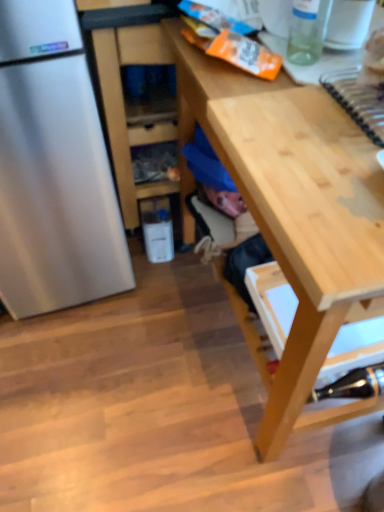
Question: From the image's perspective, is light wood desk at center under transparent glass bottle at upper right, placed as the 2th bottle when sorted from back to front?

Choices:
 (A) yes
 (B) no

Answer: (A)

Question: Does light wood desk at center have a greater width compared to transparent glass bottle at upper right, the 2th bottle positioned from the bottom?

Choices:
 (A) yes
 (B) no

Answer: (A)

Question: Is transparent glass bottle at upper right, which is the 1th bottle in left-to-right order, at the back of light wood desk at center?

Choices:
 (A) no
 (B) yes

Answer: (A)

Question: Considering the relative positions of light wood desk at center and transparent glass bottle at upper right, placed as the 2th bottle when sorted from back to front, in the image provided, is light wood desk at center behind transparent glass bottle at upper right, placed as the 2th bottle when sorted from back to front,?

Choices:
 (A) no
 (B) yes

Answer: (A)

Question: Is light wood desk at center directly adjacent to transparent glass bottle at upper right, the 2th bottle positioned from the bottom?

Choices:
 (A) no
 (B) yes

Answer: (A)

Question: Relative to light wood desk at center, is transparent glass bottle at upper right, which ranks as the first bottle in top-to-bottom order, in front or behind?

Choices:
 (A) behind
 (B) front

Answer: (A)

Question: Considering the positions of transparent glass bottle at upper right, the 2th bottle positioned from the bottom, and light wood desk at center in the image, is transparent glass bottle at upper right, the 2th bottle positioned from the bottom, wider or thinner than light wood desk at center?

Choices:
 (A) thin
 (B) wide

Answer: (A)

Question: Is transparent glass bottle at upper right, which is the 1th bottle in left-to-right order, to the left or to the right of light wood desk at center in the image?

Choices:
 (A) left
 (B) right

Answer: (A)

Question: Based on their sizes in the image, would you say transparent glass bottle at upper right, placed as the 2th bottle when sorted from back to front, is bigger or smaller than light wood desk at center?

Choices:
 (A) big
 (B) small

Answer: (B)

Question: Does point (291, 49) appear closer or farther from the camera than point (360, 392)?

Choices:
 (A) farther
 (B) closer

Answer: (B)

Question: In the image, is transparent glass bottle at upper right, which is the 1th bottle in left-to-right order, positioned in front of or behind metallic silver stapler at lower right, which appears as the second bottle when viewed from the top?

Choices:
 (A) front
 (B) behind

Answer: (A)

Question: From a real-world perspective, relative to metallic silver stapler at lower right, which appears as the second bottle when viewed from the top, is transparent glass bottle at upper right, placed as the 2th bottle when sorted from back to front, vertically above or below?

Choices:
 (A) below
 (B) above

Answer: (B)

Question: From the image's perspective, relative to metallic silver stapler at lower right, acting as the 2th bottle starting from the left, is transparent glass bottle at upper right, the second bottle from the right, above or below?

Choices:
 (A) above
 (B) below

Answer: (A)

Question: Considering the positions of point (336, 196) and point (349, 375), is point (336, 196) closer or farther from the camera than point (349, 375)?

Choices:
 (A) closer
 (B) farther

Answer: (A)

Question: Considering the relative positions of light wood desk at center and metallic silver stapler at lower right, which ranks as the 2th bottle in front-to-back order, in the image provided, is light wood desk at center to the left or to the right of metallic silver stapler at lower right, which ranks as the 2th bottle in front-to-back order,?

Choices:
 (A) left
 (B) right

Answer: (A)